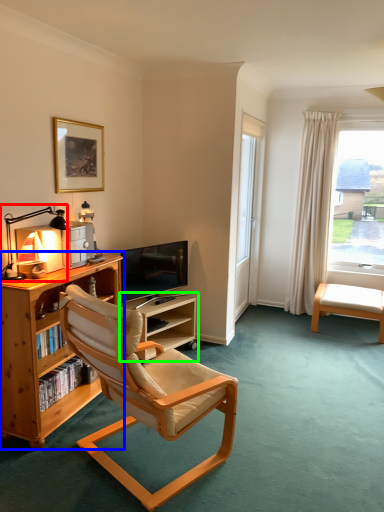
Question: Which is nearer to the lamp (highlighted by a red box)? bookcase (highlighted by a blue box) or shelf (highlighted by a green box).

Choices:
 (A) bookcase
 (B) shelf

Answer: (A)